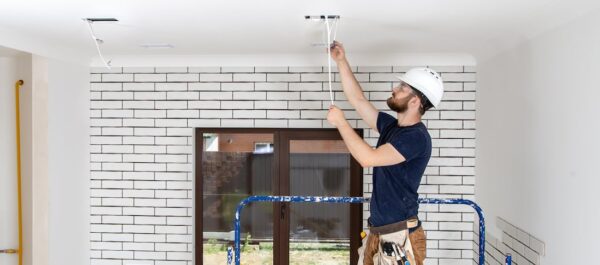
Identify the location of glass door. tap(319, 177), tap(240, 171).